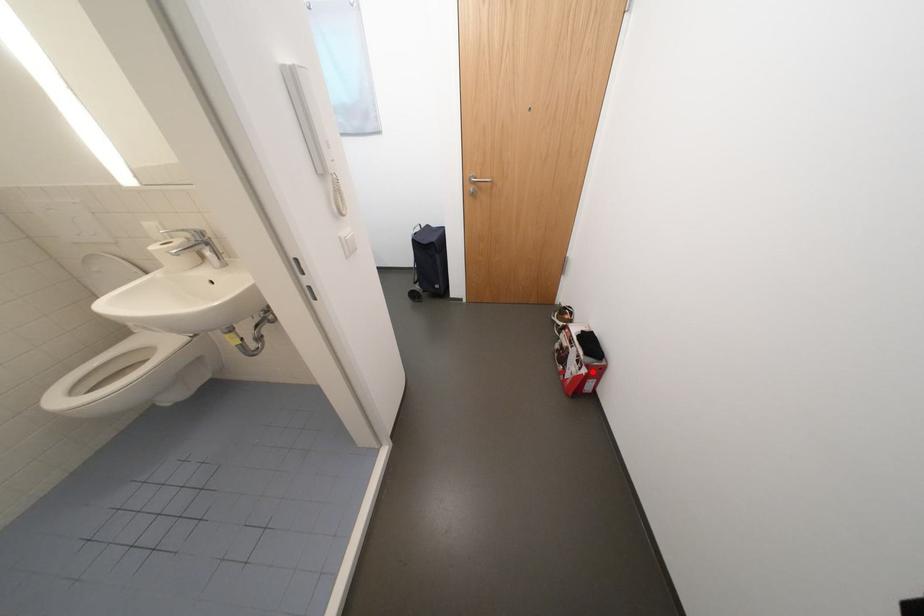
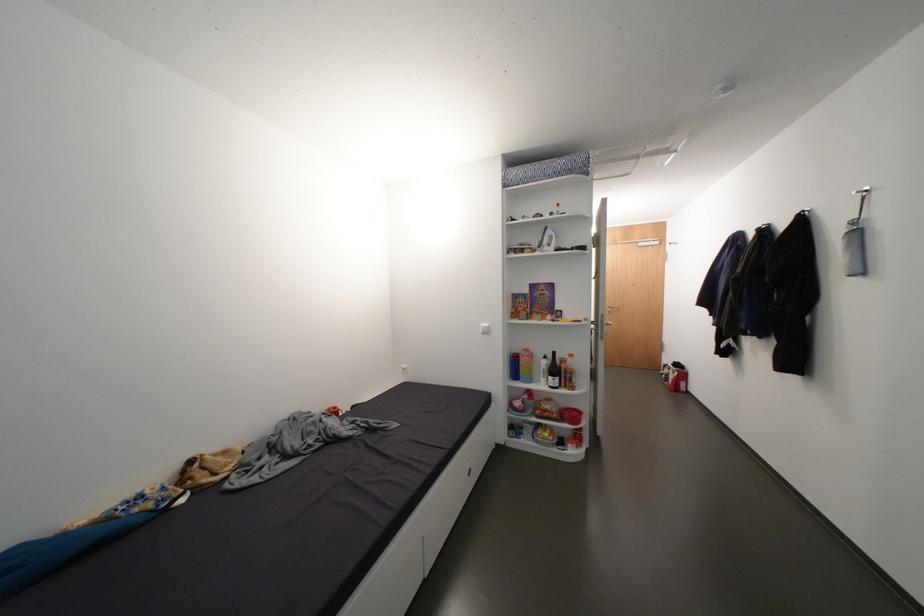
Question: I am providing you with two images of the same scene from different viewpoints. Given a red point in image1, look at the same physical point in image2. Is it:

Choices:
 (A) Closer to the viewpoint
 (B) Farther from the viewpoint

Answer: (A)